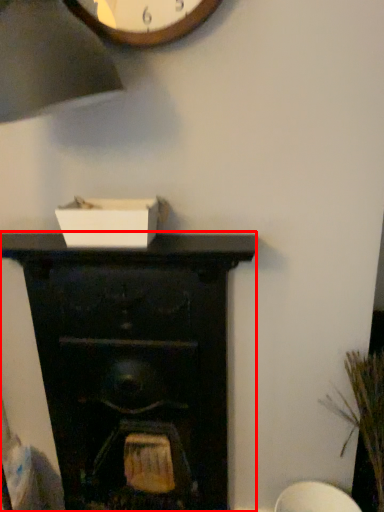
Question: Observing the image, what is the correct spatial positioning of fireplace (annotated by the red box) in reference to plant?

Choices:
 (A) right
 (B) left

Answer: (B)